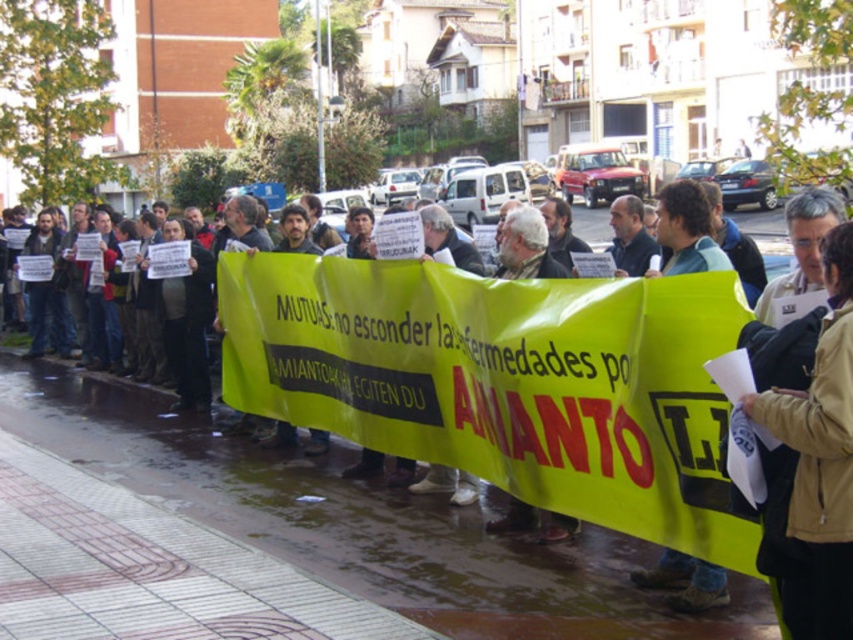
Question: Among these objects, which one is nearest to the camera?

Choices:
 (A) light brown leather jacket at center
 (B) brown leather jacket at lower right
 (C) dark brown leather jacket at center

Answer: (B)

Question: Can you confirm if brown leather jacket at lower right is bigger than light brown leather jacket at center?

Choices:
 (A) yes
 (B) no

Answer: (B)

Question: Is dark brown leather jacket at center bigger than light brown leather jacket at center?

Choices:
 (A) no
 (B) yes

Answer: (A)

Question: Which point appears farthest from the camera in this image?

Choices:
 (A) (849, 381)
 (B) (16, 445)
 (C) (727, 262)

Answer: (B)

Question: Which object is closer to the camera taking this photo?

Choices:
 (A) brown leather jacket at lower right
 (B) light brown leather jacket at center
 (C) dark brown leather jacket at center

Answer: (A)

Question: Does dark brown leather jacket at center appear over brown leather jacket at lower right?

Choices:
 (A) no
 (B) yes

Answer: (A)